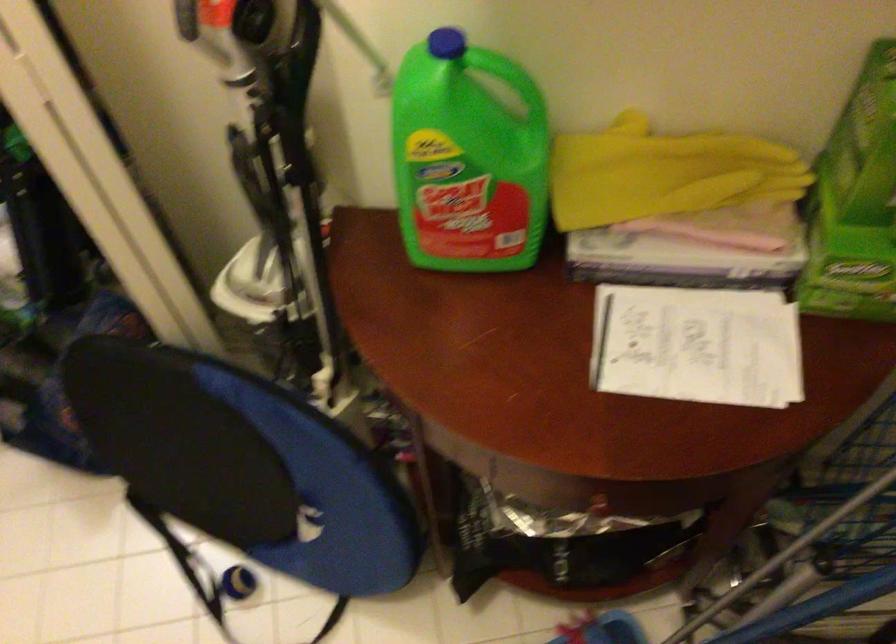
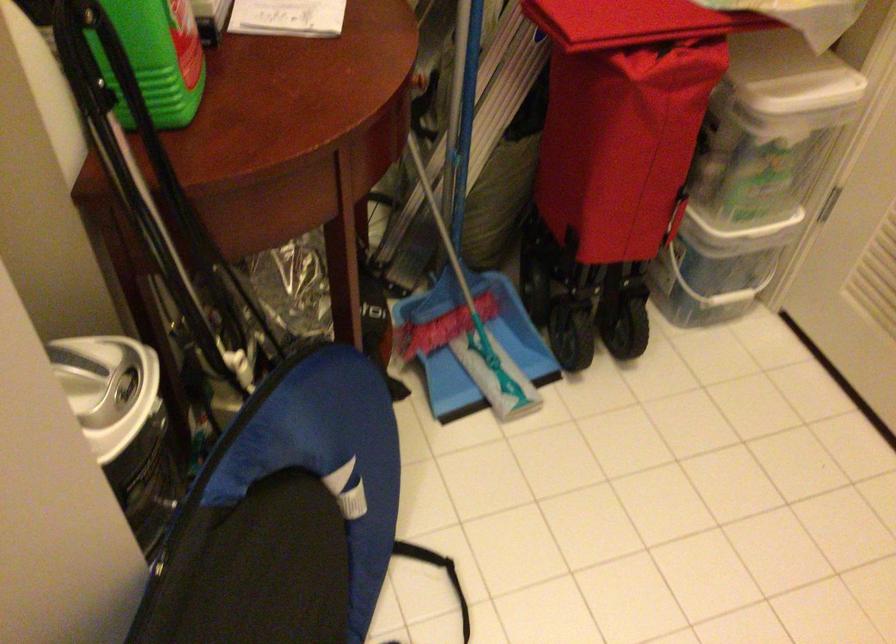
The point at (236, 301) is marked in the first image. Where is the corresponding point in the second image?

(123, 424)